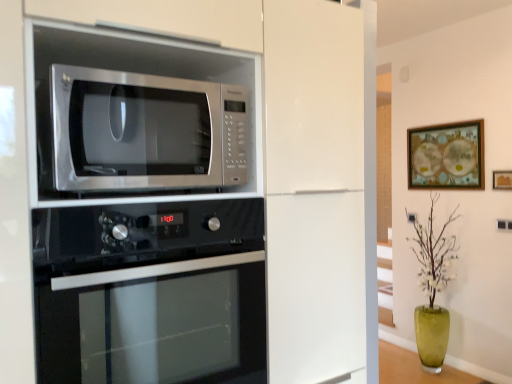
Question: Is stainless steel microwave at upper left turned away from black glass oven at lower center?

Choices:
 (A) no
 (B) yes

Answer: (A)

Question: Can you confirm if stainless steel microwave at upper left is smaller than black glass oven at lower center?

Choices:
 (A) yes
 (B) no

Answer: (A)

Question: From the image's perspective, is stainless steel microwave at upper left under black glass oven at lower center?

Choices:
 (A) no
 (B) yes

Answer: (A)

Question: Considering the relative sizes of stainless steel microwave at upper left and black glass oven at lower center in the image provided, is stainless steel microwave at upper left bigger than black glass oven at lower center?

Choices:
 (A) no
 (B) yes

Answer: (A)

Question: Are stainless steel microwave at upper left and black glass oven at lower center beside each other?

Choices:
 (A) no
 (B) yes

Answer: (A)

Question: In terms of width, does green glass vase at lower right look wider or thinner when compared to satin white oven at upper left?

Choices:
 (A) thin
 (B) wide

Answer: (A)

Question: From the image's perspective, is green glass vase at lower right located above or below satin white oven at upper left?

Choices:
 (A) above
 (B) below

Answer: (B)

Question: Is green glass vase at lower right inside or outside of satin white oven at upper left?

Choices:
 (A) outside
 (B) inside

Answer: (A)

Question: From a real-world perspective, is green glass vase at lower right positioned above or below satin white oven at upper left?

Choices:
 (A) below
 (B) above

Answer: (A)

Question: Considering the relative positions of black glass oven at lower center and green glass vase at lower right in the image provided, is black glass oven at lower center to the left or to the right of green glass vase at lower right?

Choices:
 (A) right
 (B) left

Answer: (B)

Question: From a real-world perspective, relative to green glass vase at lower right, is black glass oven at lower center vertically above or below?

Choices:
 (A) above
 (B) below

Answer: (A)

Question: Would you say black glass oven at lower center is inside or outside green glass vase at lower right?

Choices:
 (A) inside
 (B) outside

Answer: (B)

Question: In terms of size, does black glass oven at lower center appear bigger or smaller than green glass vase at lower right?

Choices:
 (A) small
 (B) big

Answer: (B)

Question: Looking at the image, does wooden framed picture at upper right, positioned as the 1th picture frame in front-to-back order, seem bigger or smaller compared to satin white oven at upper left?

Choices:
 (A) small
 (B) big

Answer: (A)

Question: Looking at their shapes, would you say wooden framed picture at upper right, the 2th picture frame positioned from the left, is wider or thinner than satin white oven at upper left?

Choices:
 (A) wide
 (B) thin

Answer: (B)